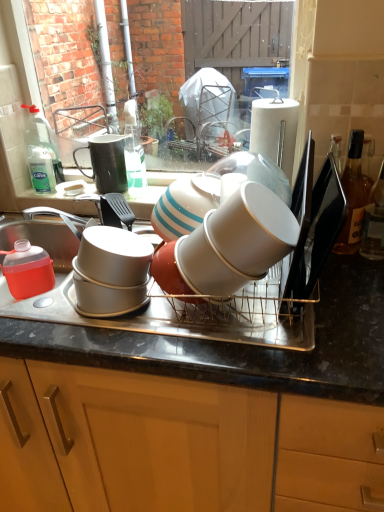
This screenshot has height=512, width=384. What do you see at coordinates (352, 197) in the screenshot?
I see `brown glass bottle at right, which ranks as the 1th bottle in left-to-right order` at bounding box center [352, 197].

The height and width of the screenshot is (512, 384). What do you see at coordinates (253, 229) in the screenshot?
I see `white glossy cup at center, which is counted as the 4th tableware, starting from the left` at bounding box center [253, 229].

Describe the element at coordinates (374, 222) in the screenshot. I see `translucent glass bottle at right, marked as the second bottle in a left-to-right arrangement` at that location.

The width and height of the screenshot is (384, 512). I want to click on brown glass bottle at right, which ranks as the 1th bottle in left-to-right order, so click(352, 197).

Is white glossy cup at center, the 2th tableware from the right, not inside translucent glass bottle at right, marked as the second bottle in a left-to-right arrangement?

That's correct, white glossy cup at center, the 2th tableware from the right, is outside of translucent glass bottle at right, marked as the second bottle in a left-to-right arrangement.

Is white glossy cup at center, the 2th tableware from the right, placed right next to translucent glass bottle at right, marked as the second bottle in a left-to-right arrangement?

No, white glossy cup at center, the 2th tableware from the right, is not beside translucent glass bottle at right, marked as the second bottle in a left-to-right arrangement.

Is white glossy cup at center, the 3th tableware in the back-to-front sequence, further to camera compared to translucent glass bottle at right, acting as the 1th bottle starting from the right?

That is False.

Is white glossy cup at center, positioned as the second tableware in front-to-back order, oriented away from translucent glass bottle at right, marked as the second bottle in a left-to-right arrangement?

No, white glossy cup at center, positioned as the second tableware in front-to-back order, is not facing the opposite direction of translucent glass bottle at right, marked as the second bottle in a left-to-right arrangement.

Is metallic gray bowls at left not within translucent plastic jug at left, the 1th tableware positioned from the left?

Yes.

Which is more to the left, metallic gray bowls at left or translucent plastic jug at left, marked as the third tableware in a front-to-back arrangement?

From the viewer's perspective, translucent plastic jug at left, marked as the third tableware in a front-to-back arrangement, appears more on the left side.

Is metallic gray bowls at left not near translucent plastic jug at left, which is the second tableware from back to front?

That's not correct — metallic gray bowls at left is a little close to translucent plastic jug at left, which is the second tableware from back to front.

Which object is closer to the camera taking this photo, metallic gray bowls at left or translucent plastic jug at left, the fourth tableware from the right?

Positioned in front is metallic gray bowls at left.

Considering the positions of point (261, 245) and point (103, 155), is point (261, 245) closer or farther from the camera than point (103, 155)?

Point (261, 245) is closer to the camera than point (103, 155).

Is white glossy cup at center, positioned as the 1th tableware in right-to-left order, beside matte black mug at upper center, which ranks as the 1th tableware in back-to-front order?

No, white glossy cup at center, positioned as the 1th tableware in right-to-left order, is not with matte black mug at upper center, which ranks as the 1th tableware in back-to-front order.

Starting from the white glossy cup at center, which is counted as the 4th tableware, starting from the left, which tableware is the 2nd one to the left? Please provide its 2D coordinates.

[(106, 163)]

Between white glossy cup at center, which appears as the first tableware when viewed from the front, and matte black mug at upper center, the fourth tableware in the front-to-back sequence, which one has smaller width?

matte black mug at upper center, the fourth tableware in the front-to-back sequence.

How much distance is there between white glossy cup at center, the 2th tableware from the right, and matte black mug at upper center, which appears as the third tableware when viewed from the right?

The distance of white glossy cup at center, the 2th tableware from the right, from matte black mug at upper center, which appears as the third tableware when viewed from the right, is 24.47 inches.

Is white glossy cup at center, placed as the third tableware when sorted from left to right, situated inside matte black mug at upper center, which ranks as the 1th tableware in back-to-front order, or outside?

white glossy cup at center, placed as the third tableware when sorted from left to right, exists outside the volume of matte black mug at upper center, which ranks as the 1th tableware in back-to-front order.

From a real-world perspective, relative to matte black mug at upper center, which ranks as the 1th tableware in back-to-front order, is white glossy cup at center, the 2th tableware from the right, vertically above or below?

In terms of real-world spatial position, white glossy cup at center, the 2th tableware from the right, is below matte black mug at upper center, which ranks as the 1th tableware in back-to-front order.

In terms of width, does white glossy cup at center, positioned as the second tableware in front-to-back order, look wider or thinner when compared to matte black mug at upper center, the fourth tableware in the front-to-back sequence?

white glossy cup at center, positioned as the second tableware in front-to-back order, is wider than matte black mug at upper center, the fourth tableware in the front-to-back sequence.

The image size is (384, 512). I want to click on window behind the metallic gray tray at center, so 236,40.

Which is more to the left, clear glass window at upper center or metallic gray tray at center?

metallic gray tray at center is more to the left.

What's the angular difference between clear glass window at upper center and metallic gray tray at center's facing directions?

clear glass window at upper center and metallic gray tray at center are facing 0.0999 degrees away from each other.

Who is shorter, clear glass window at upper center or metallic gray tray at center?

Standing shorter between the two is metallic gray tray at center.

Considering the sizes of objects clear glass window at upper center and metallic gray bowls at left in the image provided, who is wider, clear glass window at upper center or metallic gray bowls at left?

metallic gray bowls at left is wider.

From a real-world perspective, is clear glass window at upper center on metallic gray bowls at left?

Yes, from a real-world perspective, clear glass window at upper center is above metallic gray bowls at left.

Where is `window above the metallic gray bowls at left (from the image's perspective)`? window above the metallic gray bowls at left (from the image's perspective) is located at coordinates (236, 40).

In terms of height, does clear glass window at upper center look taller or shorter compared to metallic gray bowls at left?

Considering their sizes, clear glass window at upper center has more height than metallic gray bowls at left.

Is translucent plastic jug at left, the 1th tableware positioned from the left, facing towards metallic gray tray at center?

Yes, translucent plastic jug at left, the 1th tableware positioned from the left, is oriented towards metallic gray tray at center.

Is translucent plastic jug at left, which is the second tableware from back to front, to the right of metallic gray tray at center from the viewer's perspective?

Incorrect, translucent plastic jug at left, which is the second tableware from back to front, is not on the right side of metallic gray tray at center.

From a real-world perspective, is translucent plastic jug at left, the 1th tableware positioned from the left, physically below metallic gray tray at center?

No, from a real-world perspective, translucent plastic jug at left, the 1th tableware positioned from the left, is not under metallic gray tray at center.

From the translucent glass bottle at right, marked as the second bottle in a left-to-right arrangement, count 1st tablewares forward and point to it. Please provide its 2D coordinates.

[(208, 265)]

At what (x,y) coordinates should I click in order to perform the action: click on the 2nd tableware below when counting from the metallic gray bowls at left (from the image's perspective). Please return your answer as a coordinate pair (x, y). Image resolution: width=384 pixels, height=512 pixels. Looking at the image, I should click on (27, 270).

Based on the photo, estimate the real-world distances between objects in this image. Which object is closer to brown glass bottle at right, positioned as the second bottle in right-to-left order, translucent plastic jug at left, the 1th tableware positioned from the left, or translucent glass bottle at right, marked as the second bottle in a left-to-right arrangement?

translucent glass bottle at right, marked as the second bottle in a left-to-right arrangement.

Which object lies further to the anchor point white glossy cup at center, the 4th tableware from the back, metallic gray tray at center or brown glass bottle at right, positioned as the second bottle in right-to-left order?

Based on the image, brown glass bottle at right, positioned as the second bottle in right-to-left order, appears to be further to white glossy cup at center, the 4th tableware from the back.

Considering their positions, is metallic gray bowls at left positioned closer to metallic gray tray at center than translucent glass bottle at right, marked as the second bottle in a left-to-right arrangement?

The object closer to metallic gray tray at center is metallic gray bowls at left.

Looking at this image, estimate the real-world distances between objects in this image. Which object is further from white glossy cup at center, placed as the third tableware when sorted from left to right, metallic gray tray at center or translucent glass bottle at right, marked as the second bottle in a left-to-right arrangement?

Among the two, translucent glass bottle at right, marked as the second bottle in a left-to-right arrangement, is located further to white glossy cup at center, placed as the third tableware when sorted from left to right.

Based on their spatial positions, is translucent glass bottle at right, marked as the second bottle in a left-to-right arrangement, or brown glass bottle at right, which ranks as the 1th bottle in left-to-right order, closer to clear glass window at upper center?

The object closer to clear glass window at upper center is brown glass bottle at right, which ranks as the 1th bottle in left-to-right order.

Considering their positions, is white glossy cup at center, the 4th tableware from the back, positioned closer to metallic gray bowls at left than white glossy cup at center, the 3th tableware in the back-to-front sequence?

white glossy cup at center, the 3th tableware in the back-to-front sequence, lies closer to metallic gray bowls at left than the other object.

Estimate the real-world distances between objects in this image. Which object is further from white glossy cup at center, the 4th tableware from the back, translucent plastic jug at left, which is the second tableware from back to front, or translucent glass bottle at right, acting as the 1th bottle starting from the right?

The object further to white glossy cup at center, the 4th tableware from the back, is translucent plastic jug at left, which is the second tableware from back to front.

Based on their spatial positions, is matte black mug at upper center, the second tableware in the left-to-right sequence, or metallic gray tray at center closer to translucent glass bottle at right, acting as the 1th bottle starting from the right?

Among the two, metallic gray tray at center is located nearer to translucent glass bottle at right, acting as the 1th bottle starting from the right.

Find the location of a particular element. tableware between white glossy cup at center, placed as the third tableware when sorted from left to right, and translucent glass bottle at right, acting as the 1th bottle starting from the right is located at coordinates (253, 229).

At what (x,y) coordinates should I click in order to perform the action: click on sink situated between translucent plastic jug at left, the fourth tableware from the right, and white glossy cup at center, positioned as the second tableware in front-to-back order, from left to right. Please return your answer as a coordinate pair (x, y). The image size is (384, 512). Looking at the image, I should click on (82, 254).

Find the location of a particular element. The height and width of the screenshot is (512, 384). countertop between matte black mug at upper center, which appears as the third tableware when viewed from the right, and translucent glass bottle at right, marked as the second bottle in a left-to-right arrangement is located at coordinates (242, 345).

Where is `sink situated between metallic gray tray at center and translucent glass bottle at right, marked as the second bottle in a left-to-right arrangement, from left to right`? sink situated between metallic gray tray at center and translucent glass bottle at right, marked as the second bottle in a left-to-right arrangement, from left to right is located at coordinates (82, 254).